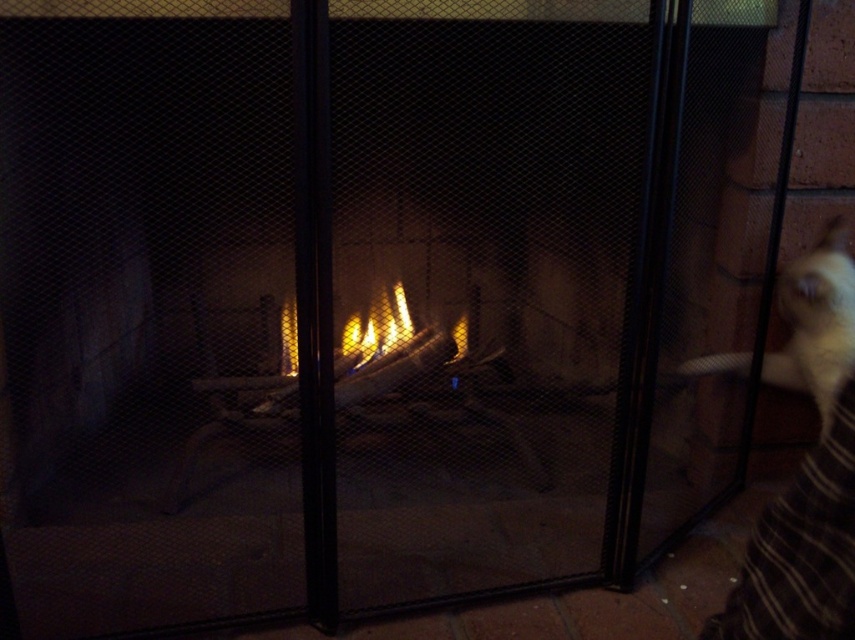
Question: Can you confirm if white fur cat at right is positioned above flametransparentfire at center?

Choices:
 (A) no
 (B) yes

Answer: (B)

Question: Among these points, which one is farthest from the camera?

Choices:
 (A) (343, 330)
 (B) (820, 300)

Answer: (A)

Question: Is white fur cat at right wider than flametransparentfire at center?

Choices:
 (A) no
 (B) yes

Answer: (A)

Question: Which of the following is the farthest from the observer?

Choices:
 (A) white fur cat at right
 (B) flametransparentfire at center

Answer: (B)

Question: Observing the image, what is the correct spatial positioning of white fur cat at right in reference to flametransparentfire at center?

Choices:
 (A) right
 (B) left

Answer: (A)

Question: Which object is farther from the camera taking this photo?

Choices:
 (A) flametransparentfire at center
 (B) white fur cat at right

Answer: (A)